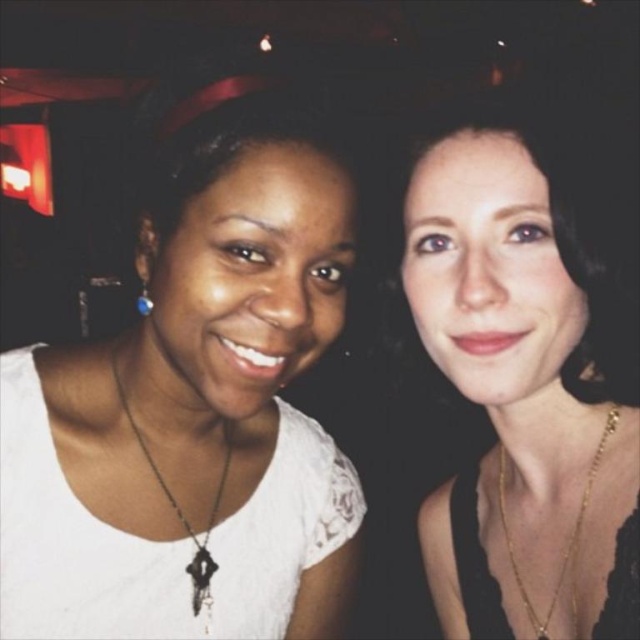
Question: Which point is farther from the camera taking this photo?

Choices:
 (A) (608, 416)
 (B) (348, 232)

Answer: (A)

Question: Can you confirm if matte black hair at upper right is bigger than blue gemstone earring at left?

Choices:
 (A) no
 (B) yes

Answer: (B)

Question: Can you confirm if matte black hair at upper right is bigger than blue gemstone earring at left?

Choices:
 (A) yes
 (B) no

Answer: (A)

Question: Which point is closer to the camera?

Choices:
 (A) white matte necklace at center
 (B) gold chain necklace at right
 (C) black matte key pendant at center

Answer: (A)

Question: Which object appears farthest from the camera in this image?

Choices:
 (A) white matte necklace at center
 (B) matte black hair at upper right

Answer: (B)

Question: Does black matte key pendant at center lie in front of blue gemstone earring at left?

Choices:
 (A) yes
 (B) no

Answer: (B)